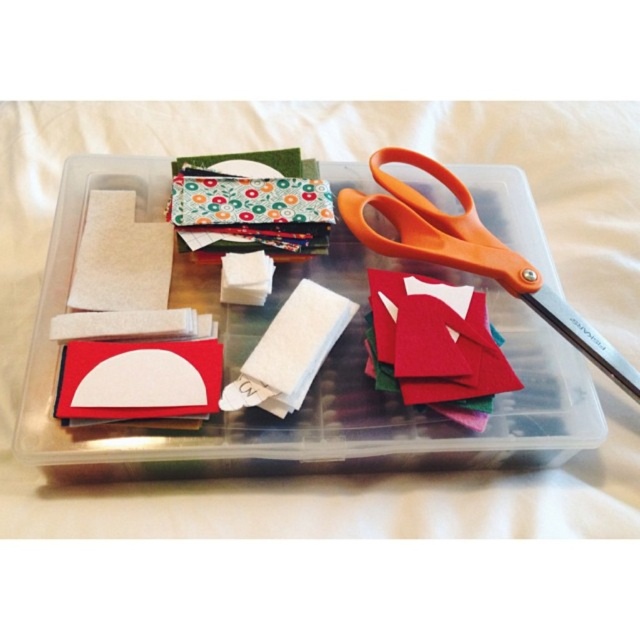
You are organizing your craft supplies and need to place the orange plastic scissors at upper right into the translucent plastic container at center. Can you directly reach the container without moving any other items?

The translucent plastic container at center is below the orange plastic scissors at upper right, so you can directly reach the container without needing to move other items as they are positioned in a vertical arrangement.

You are holding a camera 3.90 feet away from the translucent plastic container at center. Can you capture the entire container in one photo without moving closer?

The camera is exactly 3.90 feet away from the translucent plastic container at center. Assuming the camera has a wide enough lens, it should be possible to capture the entire container in one photo without moving closer.

You are organizing your craft supplies and need to place a new item at point (314, 381). What object is already located there?

The translucent plastic container at center is located at point (314, 381).